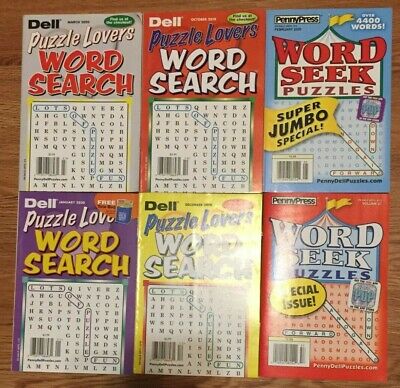
Locate an element on the screen. blue book is located at coordinates (386, 69).